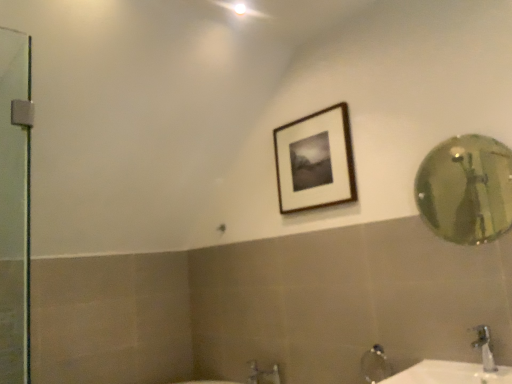
Question: Does gold reflective mirror at right have a lesser width compared to wooden framed picture at upper center?

Choices:
 (A) no
 (B) yes

Answer: (B)

Question: Can you confirm if gold reflective mirror at right is wider than wooden framed picture at upper center?

Choices:
 (A) yes
 (B) no

Answer: (B)

Question: Is gold reflective mirror at right far away from wooden framed picture at upper center?

Choices:
 (A) no
 (B) yes

Answer: (B)

Question: From a real-world perspective, is gold reflective mirror at right positioned under wooden framed picture at upper center based on gravity?

Choices:
 (A) yes
 (B) no

Answer: (A)

Question: Is gold reflective mirror at right next to wooden framed picture at upper center and touching it?

Choices:
 (A) no
 (B) yes

Answer: (A)

Question: From the image's perspective, is gold reflective mirror at right on top of wooden framed picture at upper center?

Choices:
 (A) no
 (B) yes

Answer: (A)

Question: Considering the relative sizes of silver metallic faucet at lower right and wooden framed picture at upper center in the image provided, is silver metallic faucet at lower right wider than wooden framed picture at upper center?

Choices:
 (A) yes
 (B) no

Answer: (A)

Question: From a real-world perspective, is silver metallic faucet at lower right physically above wooden framed picture at upper center?

Choices:
 (A) no
 (B) yes

Answer: (A)

Question: Is silver metallic faucet at lower right taller than wooden framed picture at upper center?

Choices:
 (A) no
 (B) yes

Answer: (A)

Question: Is silver metallic faucet at lower right at the right side of wooden framed picture at upper center?

Choices:
 (A) no
 (B) yes

Answer: (B)

Question: Is silver metallic faucet at lower right oriented away from wooden framed picture at upper center?

Choices:
 (A) yes
 (B) no

Answer: (B)

Question: Is silver metallic faucet at lower right to the left of wooden framed picture at upper center from the viewer's perspective?

Choices:
 (A) no
 (B) yes

Answer: (A)

Question: Is gold reflective mirror at right far from white glossy sink at lower right?

Choices:
 (A) no
 (B) yes

Answer: (B)